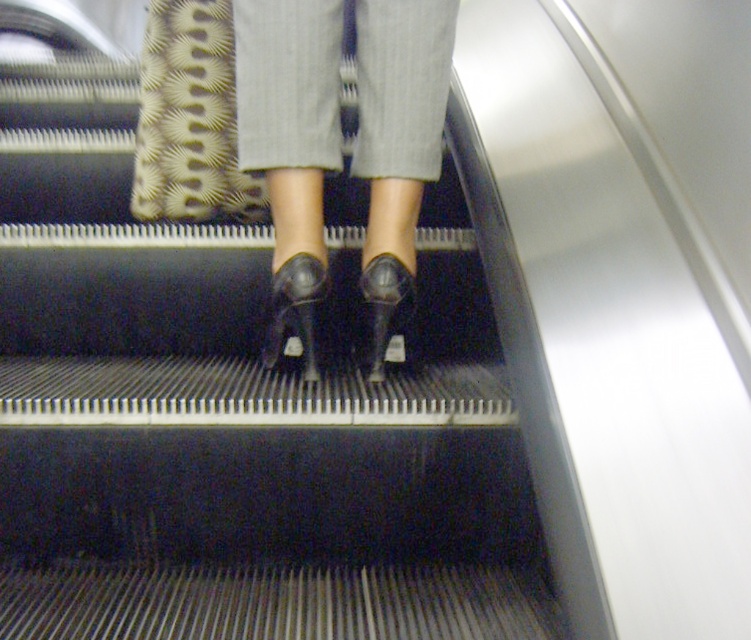
You are a security camera monitoring the escalator. You need to determine if the black leather high heels at center are within the safe distance threshold of 1 meter for tracking. Is the distance within the limit?

The black leather high heels at center is 1.06 meters away from camera, which is slightly beyond the 1 meter threshold, so it is outside the safe distance for tracking.

You are a security camera monitoring the escalator. You need to determine if the point at coordinates (x=290, y=141) is located on the black leather high heels at center. Based on the description, what is your conclusion?

The point at coordinates (x=290, y=141) is located on the black leather high heels at center according to the description.